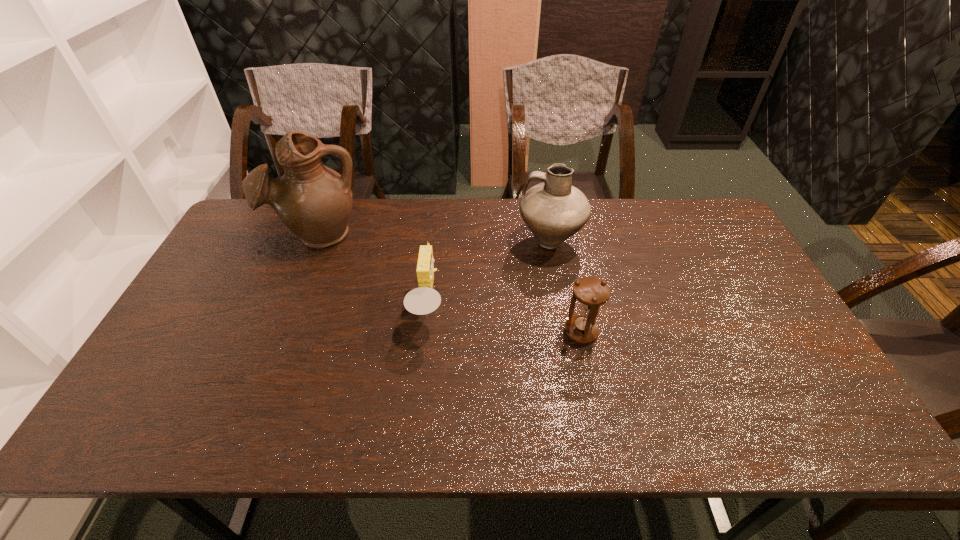
Where is `the left pitcher`? the left pitcher is located at coordinates (313, 201).

The height and width of the screenshot is (540, 960). I want to click on the leftmost object, so click(x=313, y=201).

The image size is (960, 540). Find the location of `the shorter pitcher`. the shorter pitcher is located at coordinates (554, 210).

This screenshot has height=540, width=960. What are the coordinates of `the third shortest object` in the screenshot? It's located at (554, 210).

The width and height of the screenshot is (960, 540). I want to click on hourglass, so click(x=591, y=292).

Identify the location of sponge. The width and height of the screenshot is (960, 540). [423, 300].

Where is `vacant space situated 0.210m at the spout of the taller pitcher`? The height and width of the screenshot is (540, 960). vacant space situated 0.210m at the spout of the taller pitcher is located at coordinates (288, 308).

Where is `vacant point located 0.170m on the handle side of the shorter pitcher`? vacant point located 0.170m on the handle side of the shorter pitcher is located at coordinates (465, 241).

Find the location of a particular element. The width and height of the screenshot is (960, 540). free space located 0.400m on the handle side of the shorter pitcher is located at coordinates (395, 241).

Image resolution: width=960 pixels, height=540 pixels. I want to click on free space located 0.180m on the handle side of the shorter pitcher, so click(462, 241).